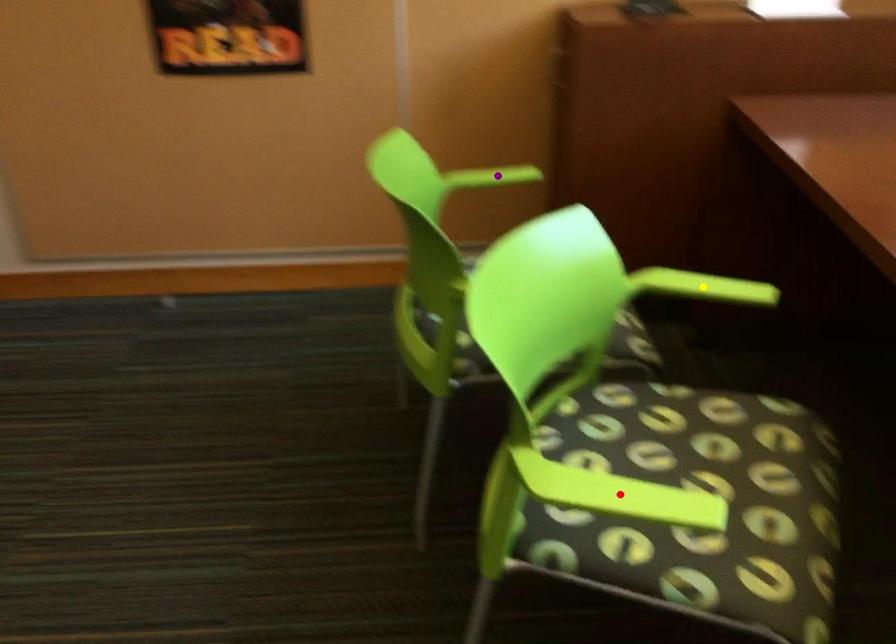
Order these from farthest to nearest:
yellow point | red point | purple point

purple point → yellow point → red point